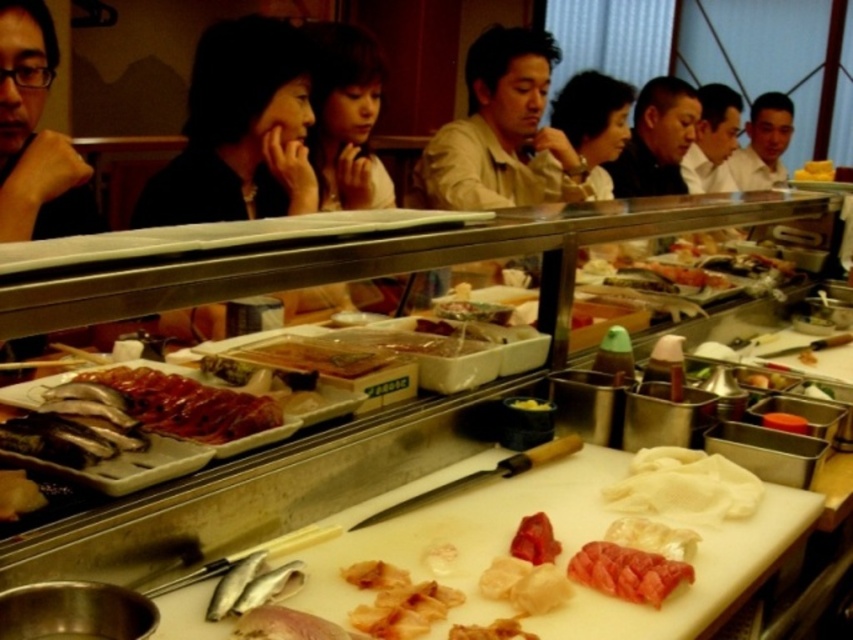
Question: Which object is the closest to the pink glossy raw fish at center?

Choices:
 (A) smooth beige shirt at upper right
 (B) pink raw fish at center
 (C) black matte hair at upper left
 (D) yellowish matte fish slice at lower left

Answer: (B)

Question: In this image, where is shiny red meat at center located relative to light brown shirt at upper right?

Choices:
 (A) left
 (B) right

Answer: (A)

Question: Which point is closer to the camera taking this photo?

Choices:
 (A) (38, 486)
 (B) (164, 420)
 (C) (543, 540)
 (D) (258, 186)

Answer: (A)

Question: Which point is closer to the camera taking this photo?

Choices:
 (A) (515, 154)
 (B) (141, 385)
 (C) (7, 509)

Answer: (C)

Question: Is black matte hair at upper left thinner than yellow matte sushi at upper right?

Choices:
 (A) no
 (B) yes

Answer: (A)

Question: Can you confirm if yellowish matte fish slice at lower left is positioned above yellow matte sushi at upper right?

Choices:
 (A) yes
 (B) no

Answer: (B)